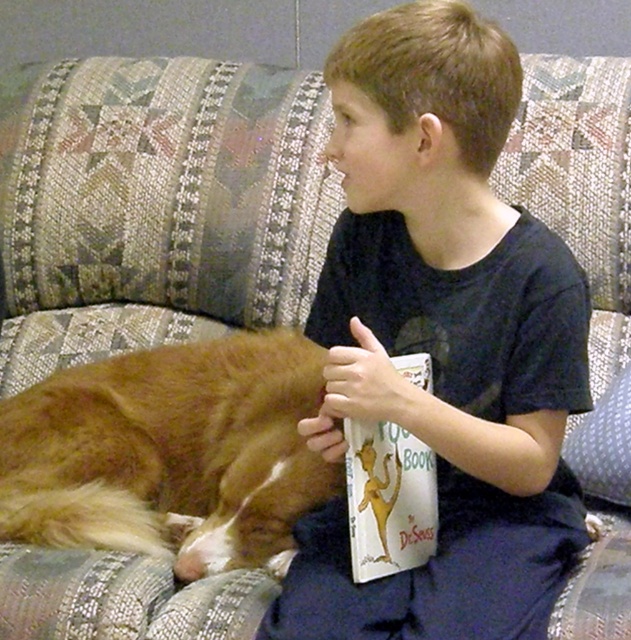
Question: Does golden fur dog at lower left have a greater width compared to white paper book at center?

Choices:
 (A) yes
 (B) no

Answer: (A)

Question: Among these objects, which one is nearest to the camera?

Choices:
 (A) golden fur dog at lower left
 (B) dark blue cotton shirt at center
 (C) white paper book at center

Answer: (B)

Question: Can you confirm if golden fur dog at lower left is bigger than white paper book at center?

Choices:
 (A) yes
 (B) no

Answer: (A)

Question: Is golden fur dog at lower left further to the viewer compared to white paper book at center?

Choices:
 (A) no
 (B) yes

Answer: (B)

Question: Which object appears closest to the camera in this image?

Choices:
 (A) white paper book at center
 (B) dark blue cotton shirt at center
 (C) golden fur dog at lower left

Answer: (B)

Question: Which object is closer to the camera taking this photo?

Choices:
 (A) white paper book at center
 (B) golden fur dog at lower left
 (C) dark blue cotton shirt at center

Answer: (C)